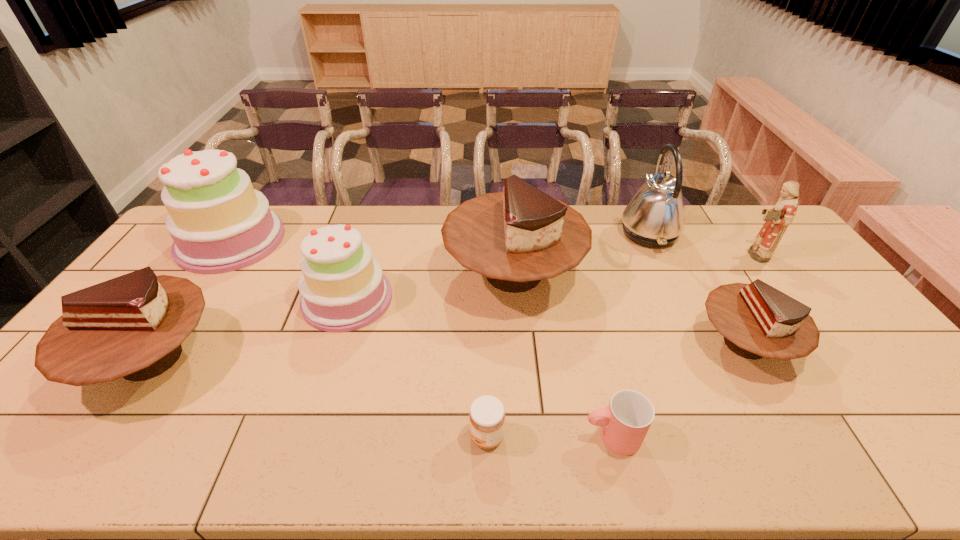
Locate an element on the screen. The width and height of the screenshot is (960, 540). cup is located at coordinates click(x=625, y=422).

Where is `orange jam`? Image resolution: width=960 pixels, height=540 pixels. orange jam is located at coordinates (487, 416).

The height and width of the screenshot is (540, 960). Identify the location of vacant space located 0.340m from the spout of the kettle. (524, 233).

In order to click on vacant region located 0.340m from the spout of the kettle in this screenshot , I will do `click(524, 233)`.

I want to click on free space located from the spout of the kettle, so (x=546, y=233).

The height and width of the screenshot is (540, 960). What are the coordinates of `vacant space situated 0.220m on the right of the left purple cake` in the screenshot? It's located at (345, 241).

I want to click on free location located on the left of the second red cake from right to left, so click(378, 273).

Identify the location of vacant point located 0.280m on the front-facing side of the rightmost object. (658, 255).

Where is `vacant region located on the front-facing side of the rightmost object`? The width and height of the screenshot is (960, 540). vacant region located on the front-facing side of the rightmost object is located at coordinates (660, 255).

Where is `free space located 0.320m on the front-facing side of the rightmost object`? The height and width of the screenshot is (540, 960). free space located 0.320m on the front-facing side of the rightmost object is located at coordinates (645, 255).